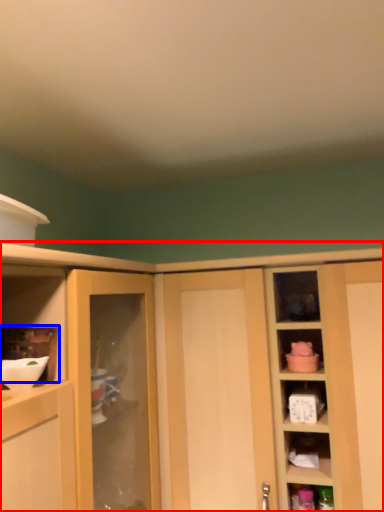
Question: Which object is further to the camera taking this photo, cabinetry (highlighted by a red box) or shelf (highlighted by a blue box)?

Choices:
 (A) cabinetry
 (B) shelf

Answer: (A)